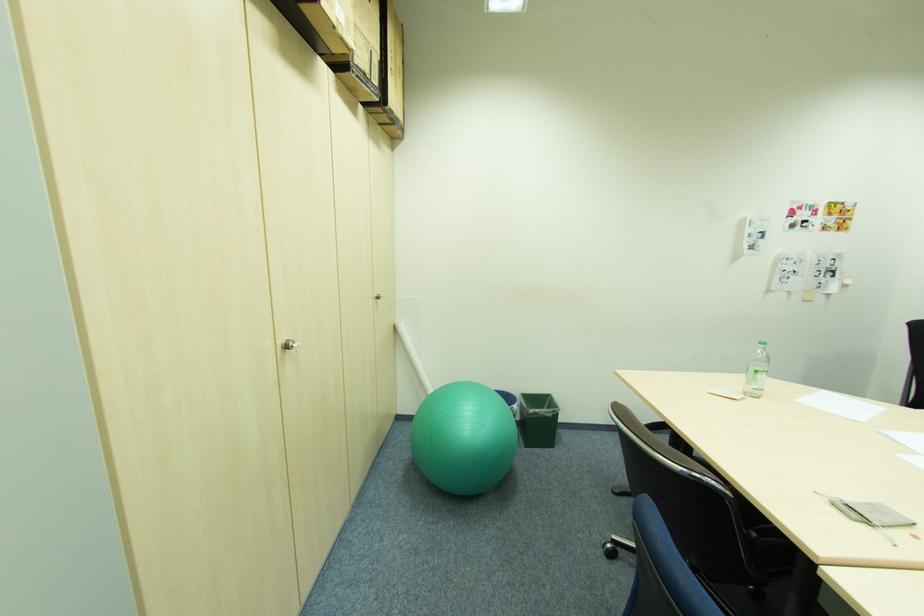
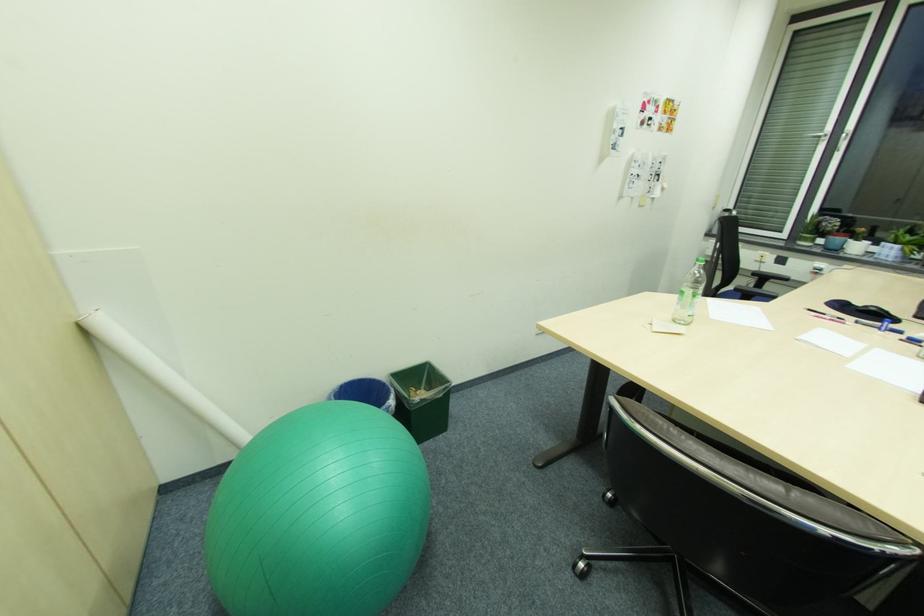
Find the pixel in the second image that matches pixel 565 411 in the first image.

(456, 385)